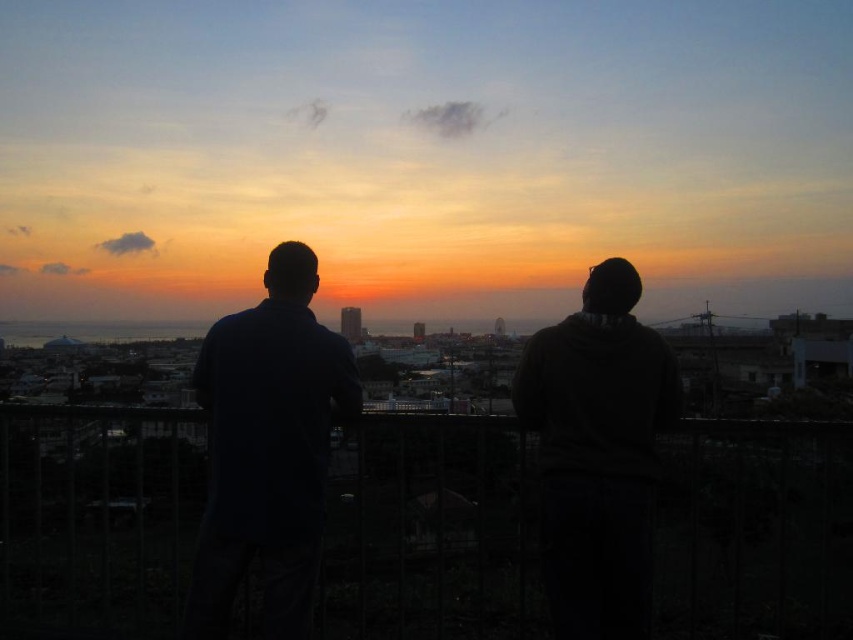
You are standing on a balcony overlooking the city and want to take a photo of both the silhouette clothing at center and the dark gray hoodie at center in the same frame. Given that your camera has a maximum zoom range of 30 meters, will you be able to capture both subjects in one shot?

The distance between the silhouette clothing at center and the dark gray hoodie at center is 29.99 meters. Since your camera can zoom up to 30 meters, you will be able to capture both subjects in one shot as the distance is just under the maximum range.

You are standing on a balcony and see two people in the scene. The dark blue shirt at left and the dark gray hoodie at center. Which one is positioned higher from the ground?

The dark blue shirt at left is above the dark gray hoodie at center, so it is positioned higher from the ground.